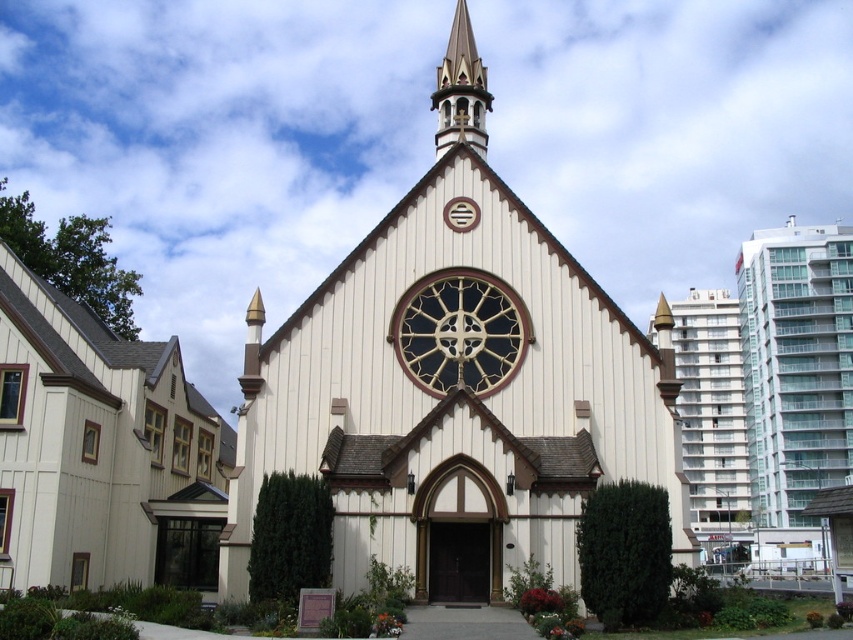
Can you confirm if white glass building at right is positioned to the left of dark stained glass clock at center?

Incorrect, white glass building at right is not on the left side of dark stained glass clock at center.

Is point (693, 474) more distant than point (439, 284)?

That is True.

What are the coordinates of `white glass building at right` in the screenshot? It's located at (709, 413).

Where is `white glass building at right`? The image size is (853, 640). white glass building at right is located at coordinates (709, 413).

Is white wood siding at left shorter than glassy concrete building at right?

Yes.

Can you confirm if white wood siding at left is positioned below glassy concrete building at right?

Yes.

Is point (183, 465) less distant than point (848, 280)?

Yes, it is.

I want to click on white wood siding at left, so click(102, 451).

In the scene shown: Is wooden chapel at center to the left of glassy concrete building at right from the viewer's perspective?

Yes, wooden chapel at center is to the left of glassy concrete building at right.

Between wooden chapel at center and glassy concrete building at right, which one is positioned higher?

glassy concrete building at right

Where is `wooden chapel at center`? This screenshot has height=640, width=853. wooden chapel at center is located at coordinates coord(456,397).